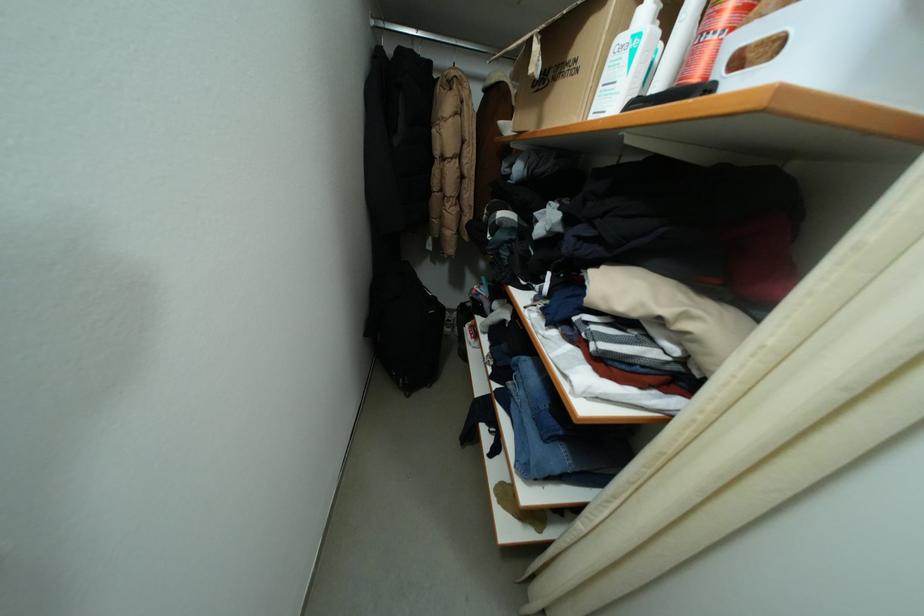
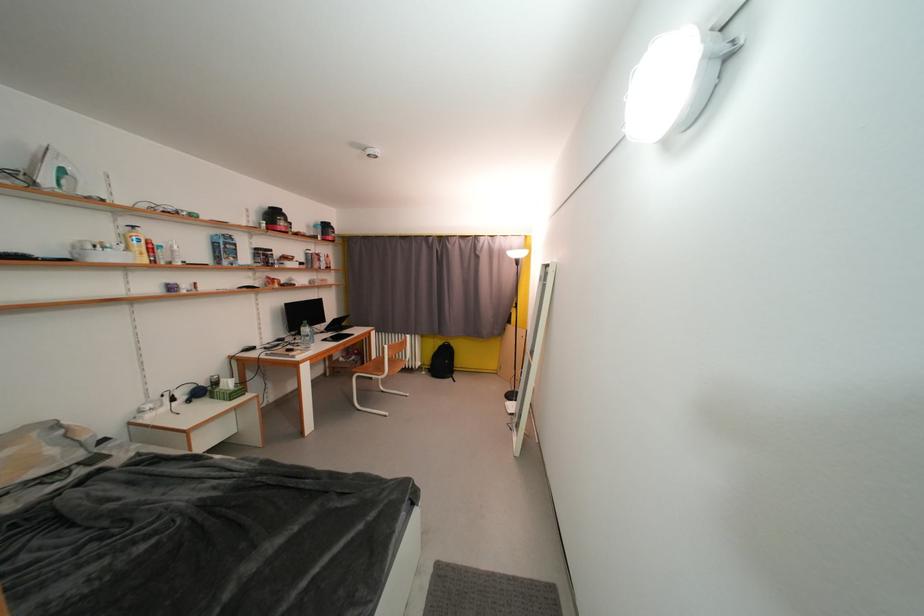
Question: The images are taken continuously from a first-person perspective. In which direction is your viewpoint rotating?

Choices:
 (A) Left
 (B) Right
 (C) Up
 (D) Down

Answer: (B)